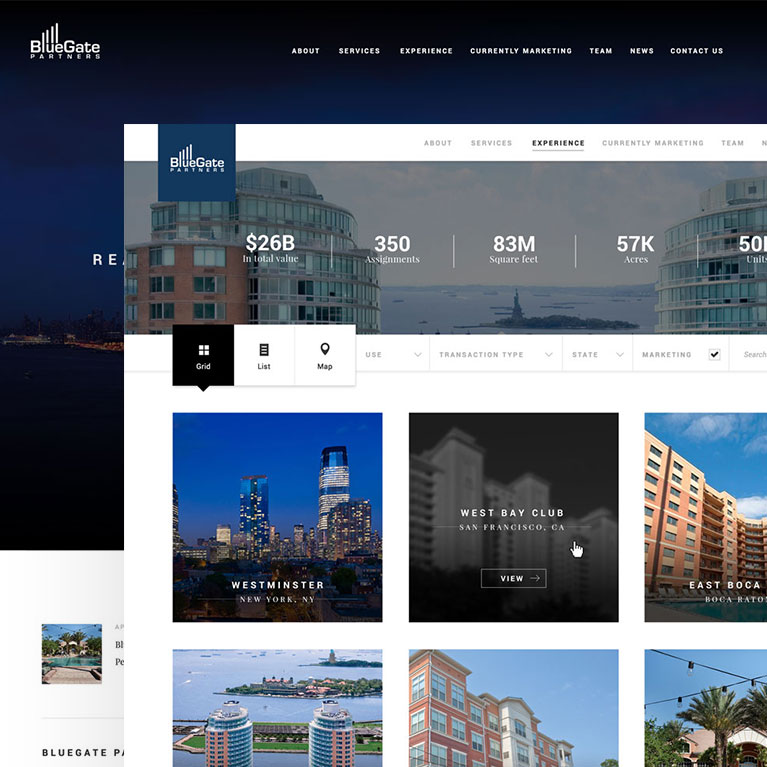
The image size is (767, 767). In order to click on string lights in this screenshot , I will do `click(693, 667)`.